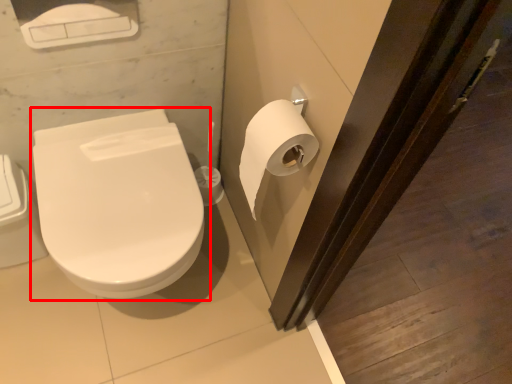
Question: Considering the relative positions of toilet (annotated by the red box) and toilet paper in the image provided, where is toilet (annotated by the red box) located with respect to the staircase?

Choices:
 (A) right
 (B) left

Answer: (B)